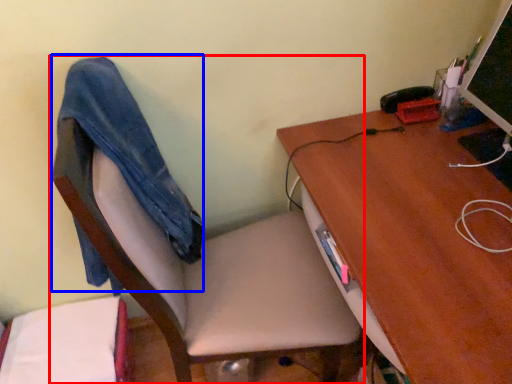
Question: Which object appears closest to the camera in this image, chair (highlighted by a red box) or jeans (highlighted by a blue box)?

Choices:
 (A) chair
 (B) jeans

Answer: (A)